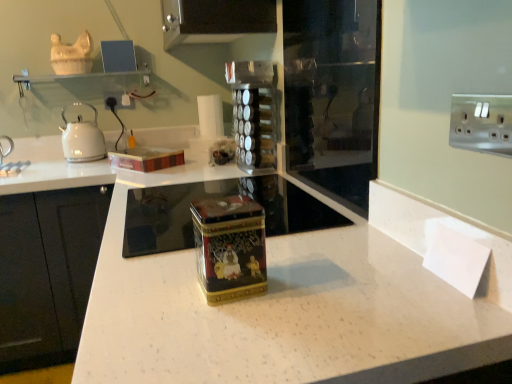
Question: Is white plastic electric outlet at upper right at the back of clear plastic spice rack at center?

Choices:
 (A) yes
 (B) no

Answer: (B)

Question: Is clear plastic spice rack at center smaller than white plastic electric outlet at upper right?

Choices:
 (A) yes
 (B) no

Answer: (B)

Question: From a real-world perspective, is clear plastic spice rack at center located beneath white plastic electric outlet at upper right?

Choices:
 (A) no
 (B) yes

Answer: (B)

Question: From the image's perspective, would you say clear plastic spice rack at center is positioned over white plastic electric outlet at upper right?

Choices:
 (A) yes
 (B) no

Answer: (B)

Question: From the image's perspective, is clear plastic spice rack at center below white plastic electric outlet at upper right?

Choices:
 (A) yes
 (B) no

Answer: (A)

Question: In terms of height, does gold metallic tin at center look taller or shorter compared to clear glass shelf at upper center?

Choices:
 (A) tall
 (B) short

Answer: (A)

Question: Is gold metallic tin at center to the left or to the right of clear glass shelf at upper center in the image?

Choices:
 (A) right
 (B) left

Answer: (A)

Question: In terms of size, does gold metallic tin at center appear bigger or smaller than clear glass shelf at upper center?

Choices:
 (A) big
 (B) small

Answer: (B)

Question: From the image's perspective, is gold metallic tin at center positioned above or below clear glass shelf at upper center?

Choices:
 (A) above
 (B) below

Answer: (B)

Question: Is transparent glass door at center to the left or to the right of white glossy kettle at left in the image?

Choices:
 (A) right
 (B) left

Answer: (A)

Question: Is transparent glass door at center bigger or smaller than white glossy kettle at left?

Choices:
 (A) big
 (B) small

Answer: (A)

Question: Would you say transparent glass door at center is inside or outside white glossy kettle at left?

Choices:
 (A) inside
 (B) outside

Answer: (B)

Question: Looking at their shapes, would you say transparent glass door at center is wider or thinner than white glossy kettle at left?

Choices:
 (A) thin
 (B) wide

Answer: (A)

Question: From their relative heights in the image, would you say clear glass shelf at upper center is taller or shorter than white plastic electric outlet at upper right?

Choices:
 (A) tall
 (B) short

Answer: (A)

Question: Considering the positions of clear glass shelf at upper center and white plastic electric outlet at upper right in the image, is clear glass shelf at upper center bigger or smaller than white plastic electric outlet at upper right?

Choices:
 (A) small
 (B) big

Answer: (B)